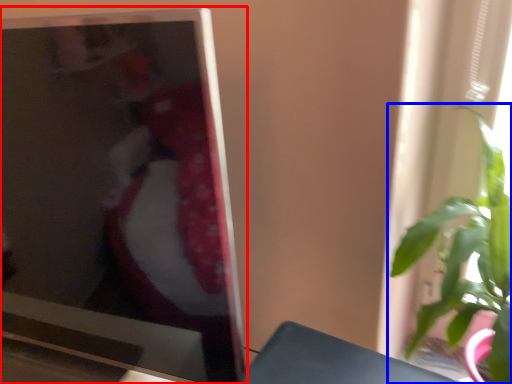
Question: Which object appears farthest to the camera in this image, television (highlighted by a red box) or houseplant (highlighted by a blue box)?

Choices:
 (A) television
 (B) houseplant

Answer: (B)